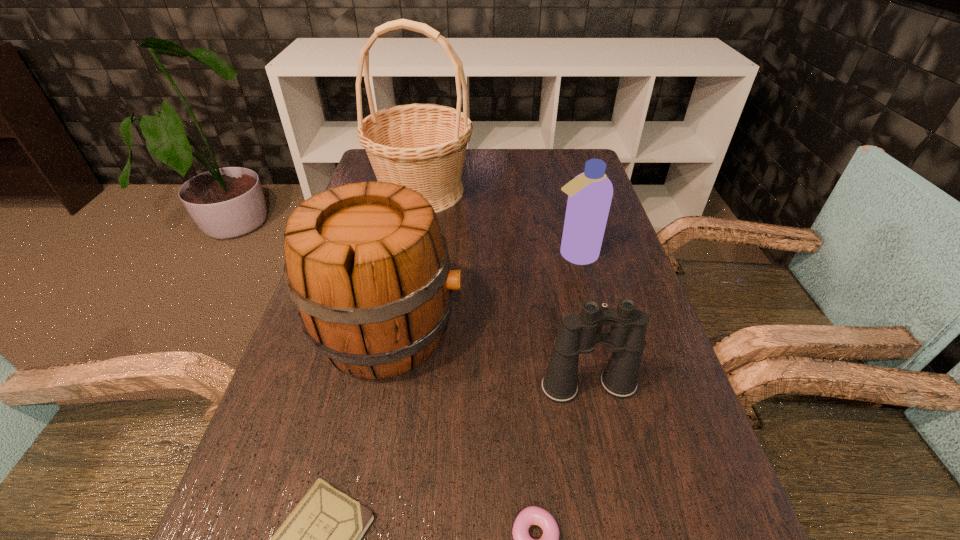
This screenshot has height=540, width=960. I want to click on basket present at the left edge, so pyautogui.click(x=421, y=146).

Identify the location of cider that is at the left edge. This screenshot has width=960, height=540. (367, 265).

Identify the location of shampoo that is positioned at the right edge. (590, 193).

At what (x,y) coordinates should I click in order to perform the action: click on binoculars that is at the right edge. Please return your answer as a coordinate pair (x, y). Image resolution: width=960 pixels, height=540 pixels. Looking at the image, I should click on (578, 335).

The width and height of the screenshot is (960, 540). Find the location of `object present at the far left corner`. object present at the far left corner is located at coordinates (421, 146).

At what (x,y) coordinates should I click in order to perform the action: click on blank space at the far edge of the desktop. Please return your answer as a coordinate pair (x, y). The width and height of the screenshot is (960, 540). Looking at the image, I should click on (492, 159).

You are a GUI agent. You are given a task and a screenshot of the screen. Output one action in this format:
    pyautogui.click(x=<x>, y=<y>)
    Task: Click on the free point at the right edge
    The height and width of the screenshot is (540, 960).
    Given the screenshot: What is the action you would take?
    pyautogui.click(x=589, y=284)

Identify the location of free spot between the fifth nearest object and the cider. (481, 293).

I want to click on empty space that is in between the shampoo and the cider, so click(481, 293).

Locate an element on the screen. unoccupied position between the second farthest object and the cider is located at coordinates (481, 293).